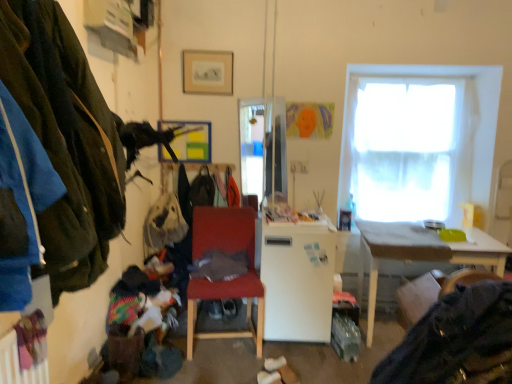
The height and width of the screenshot is (384, 512). Find the location of `free point above white sheer curtain at upper right (from a real-world perspective)`. free point above white sheer curtain at upper right (from a real-world perspective) is located at coordinates (414, 81).